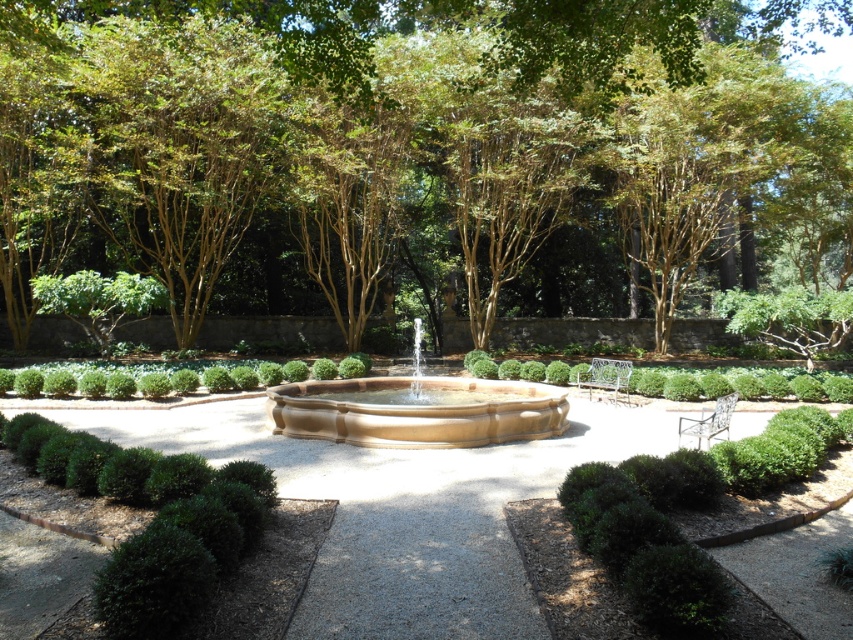
You are standing at the point marked by the coordinates point (x=416, y=410) in the garden. Based on the scene description, what object are you standing on?

The point (x=416, y=410) indicates the location of the matte stone fountain at center, so you are standing on the matte stone fountain at center.

You are a gardener who needs to water two hedges in the garden. You have a watering can with a range of 6 meters. Starting from the green bushy hedge at lower left, can you water the green textured hedge at center without moving the watering can?

The green bushy hedge at lower left and green textured hedge at center are 6.72 meters apart. Since the watering can has a range of only 6 meters, you cannot water the green textured hedge at center from the green bushy hedge at lower left without moving the watering can.